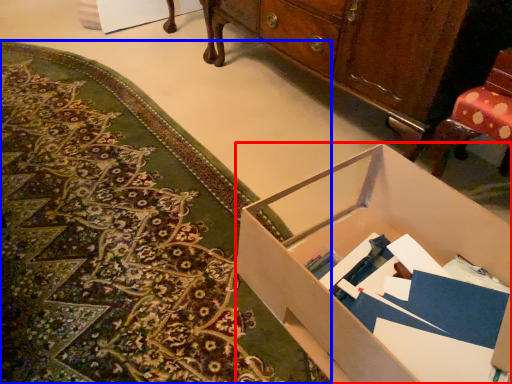
Question: Among these objects, which one is nearest to the camera, desk (highlighted by a red box) or mat (highlighted by a blue box)?

Choices:
 (A) desk
 (B) mat

Answer: (A)